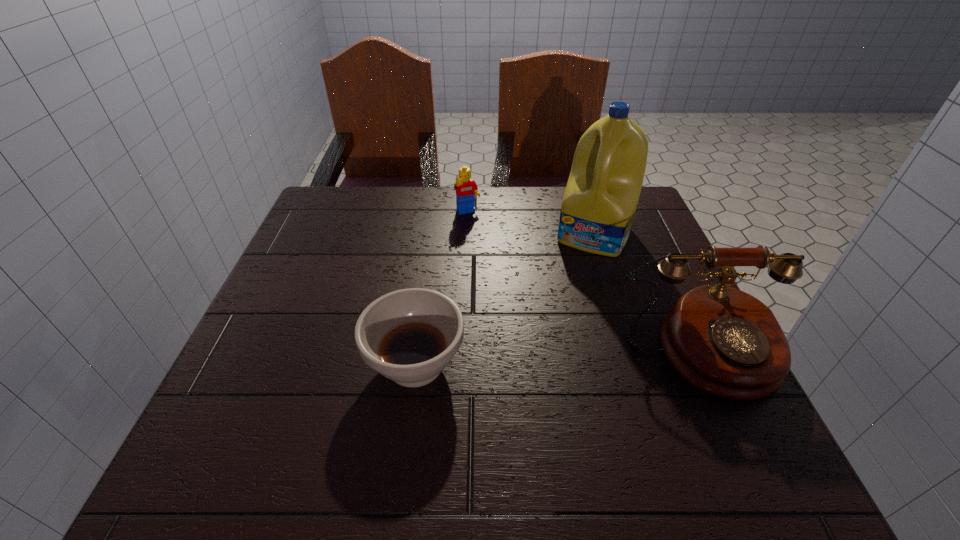
Locate an element on the screen. empty location between the shortest object and the telephone is located at coordinates (559, 359).

Identify the location of vacant area that lies between the soup bowl and the second shortest object. The width and height of the screenshot is (960, 540). (442, 288).

Find the location of a particular element. The image size is (960, 540). free space between the second shortest object and the soup bowl is located at coordinates (442, 288).

Locate an element on the screen. free space between the Lego and the second tallest object is located at coordinates (586, 282).

Find the location of a particular element. This screenshot has width=960, height=540. free space between the tallest object and the soup bowl is located at coordinates (505, 299).

At what (x,y) coordinates should I click in order to perform the action: click on object that is the closest to the second tallest object. Please return your answer as a coordinate pair (x, y). Image resolution: width=960 pixels, height=540 pixels. Looking at the image, I should click on (599, 204).

Where is `object that ranks as the third closest to the second shortest object`? object that ranks as the third closest to the second shortest object is located at coordinates (725, 342).

Identify the location of vacant space that satisfies the following two spatial constraints: 1. on the back side of the detergent; 2. on the right side of the soup bowl. (433, 234).

Identify the location of vacant point that satisfies the following two spatial constraints: 1. on the front side of the detergent; 2. on the left side of the third tallest object. Image resolution: width=960 pixels, height=540 pixels. 468,234.